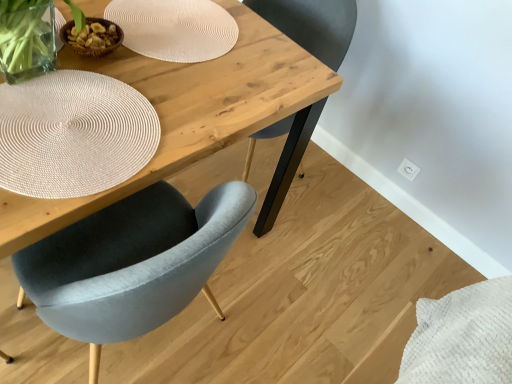
Question: From the image's perspective, is white textured placemat at upper center, which is counted as the first paper plate, starting from the back, positioned above or below white woven placemat at upper left, arranged as the second paper plate when viewed from the top?

Choices:
 (A) below
 (B) above

Answer: (B)

Question: Is white textured placemat at upper center, the 2th paper plate viewed from the front, bigger or smaller than white woven placemat at upper left, arranged as the second paper plate when viewed from the top?

Choices:
 (A) small
 (B) big

Answer: (B)

Question: Estimate the real-world distances between objects in this image. Which object is closer to the white woven placemat at upper left, arranged as the second paper plate when viewed from the top?

Choices:
 (A) white textured placemat at upper center, the 2th paper plate viewed from the front
 (B) velvet grey chair at center
 (C) natural wood table at center

Answer: (C)

Question: Which object is positioned closest to the velvet grey chair at center?

Choices:
 (A) white textured placemat at upper center, which is the second paper plate from bottom to top
 (B) natural wood table at center
 (C) white woven placemat at upper left, arranged as the second paper plate when viewed from the top

Answer: (B)